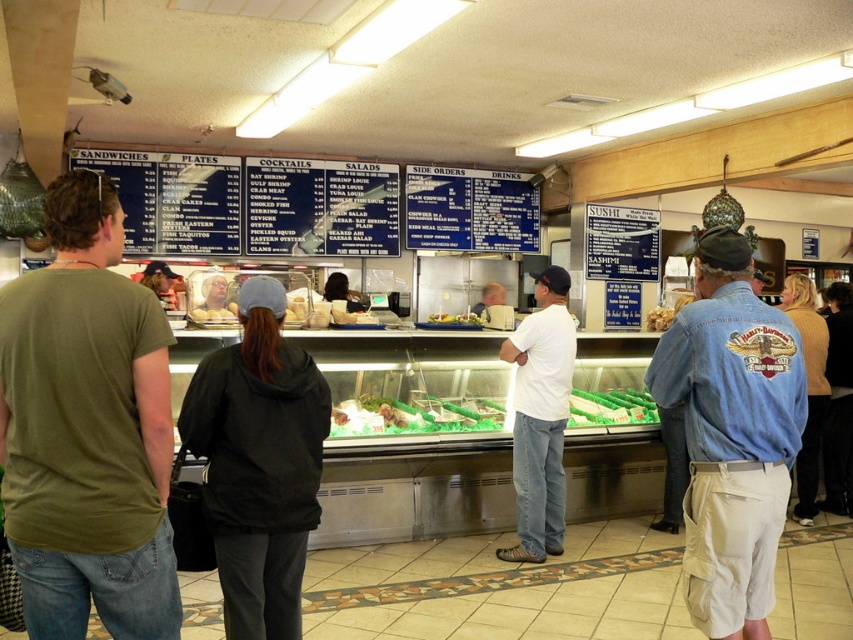
Question: Considering the relative positions of blue denim jacket at lower right and green leafy vegetables at center in the image provided, where is blue denim jacket at lower right located with respect to green leafy vegetables at center?

Choices:
 (A) left
 (B) right

Answer: (B)

Question: From the image, what is the correct spatial relationship of blue denim jacket at lower right in relation to green leafy vegetables at center?

Choices:
 (A) below
 (B) above

Answer: (B)

Question: Which of the following is the farthest from the observer?

Choices:
 (A) (822, 406)
 (B) (750, 570)
 (C) (273, 499)

Answer: (A)

Question: Which point is farther from the camera taking this photo?

Choices:
 (A) (819, 448)
 (B) (135, 580)
 (C) (256, 374)

Answer: (A)

Question: Which point is closer to the camera?

Choices:
 (A) green plastic tray at center
 (B) blue denim jacket at lower right

Answer: (A)

Question: Can you confirm if black matte jacket at center is wider than black leather jacket at lower right?

Choices:
 (A) no
 (B) yes

Answer: (B)